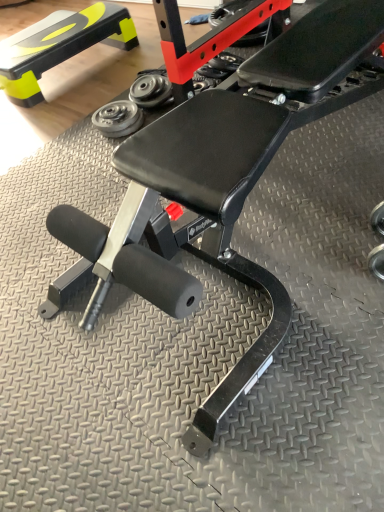
The width and height of the screenshot is (384, 512). In order to click on free space in front of matte black step at upper left in this screenshot , I will do `click(65, 111)`.